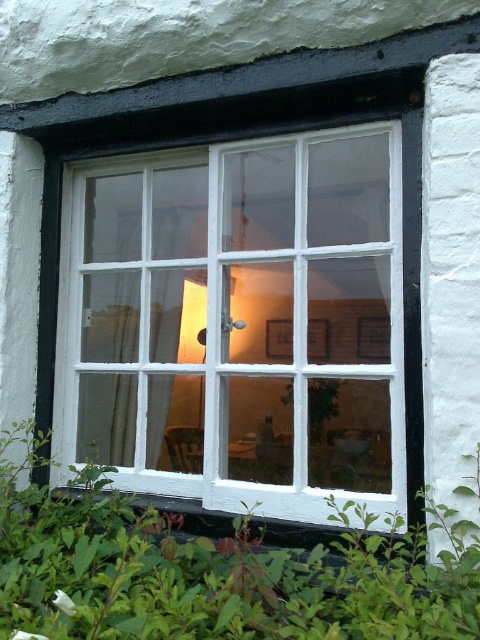
Which is more to the right, white wooden window at center or green leafy plant at lower center?

white wooden window at center

Consider the image. Who is more forward, (62, 378) or (131, 628)?

Point (131, 628)

Describe the element at coordinates (238, 321) in the screenshot. This screenshot has width=480, height=640. I see `white wooden window at center` at that location.

Where is `white wooden window at center`? Image resolution: width=480 pixels, height=640 pixels. white wooden window at center is located at coordinates (238, 321).